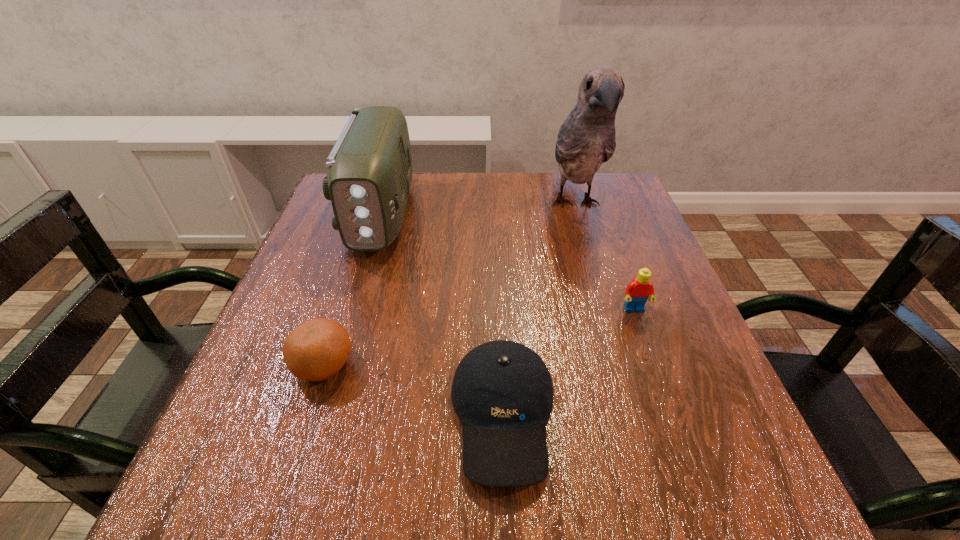
Find the location of a particular element. The width and height of the screenshot is (960, 540). vacant space at the left edge is located at coordinates (316, 302).

In the image, there is a desktop. Where is `vacant space at the right edge`? Image resolution: width=960 pixels, height=540 pixels. vacant space at the right edge is located at coordinates (679, 345).

Locate an element on the screen. Image resolution: width=960 pixels, height=540 pixels. vacant region at the near right corner of the desktop is located at coordinates (756, 467).

Identify the location of free area in between the third object from left to right and the radio_receiver. The image size is (960, 540). tap(443, 314).

The image size is (960, 540). In order to click on free space between the third nearest object and the radio_receiver in this screenshot , I will do `click(508, 262)`.

Where is `free area in between the third object from left to right and the parrot`? free area in between the third object from left to right and the parrot is located at coordinates (540, 309).

Find the location of a particular element. vacant region between the Lego and the baseball cap is located at coordinates (568, 362).

Where is `vacant space in between the clementine and the parrot`? This screenshot has width=960, height=540. vacant space in between the clementine and the parrot is located at coordinates (449, 285).

Find the location of a particular element. vacant space that is in between the baseball cap and the clementine is located at coordinates (414, 390).

Image resolution: width=960 pixels, height=540 pixels. I want to click on free space between the radio_receiver and the parrot, so click(478, 209).